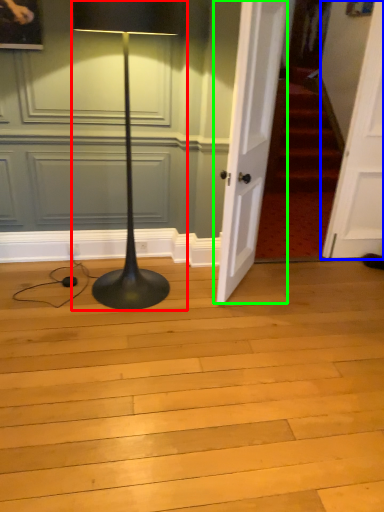
Question: Which object is positioned closest to lamp (highlighted by a red box)? Select from door (highlighted by a blue box) and door (highlighted by a green box).

Choices:
 (A) door
 (B) door

Answer: (B)